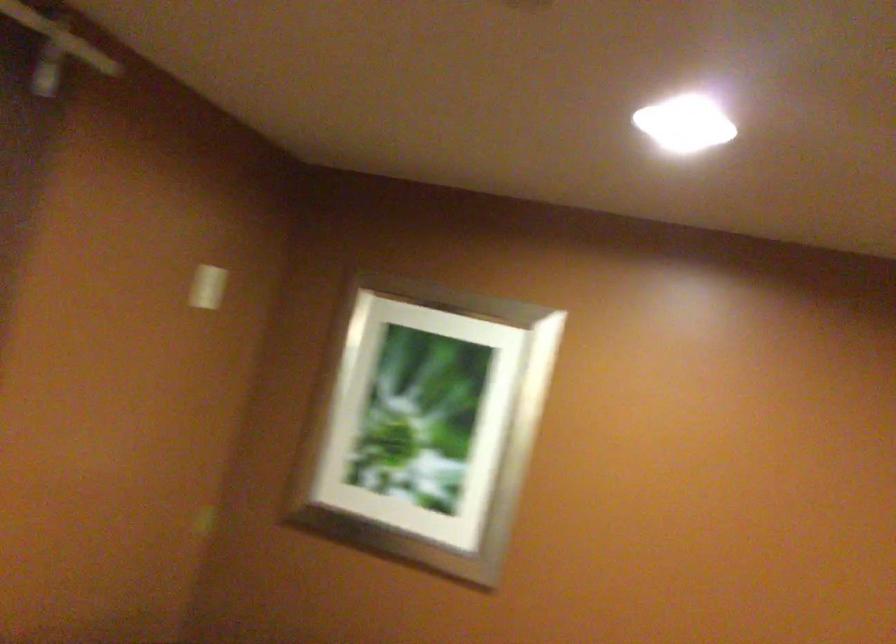
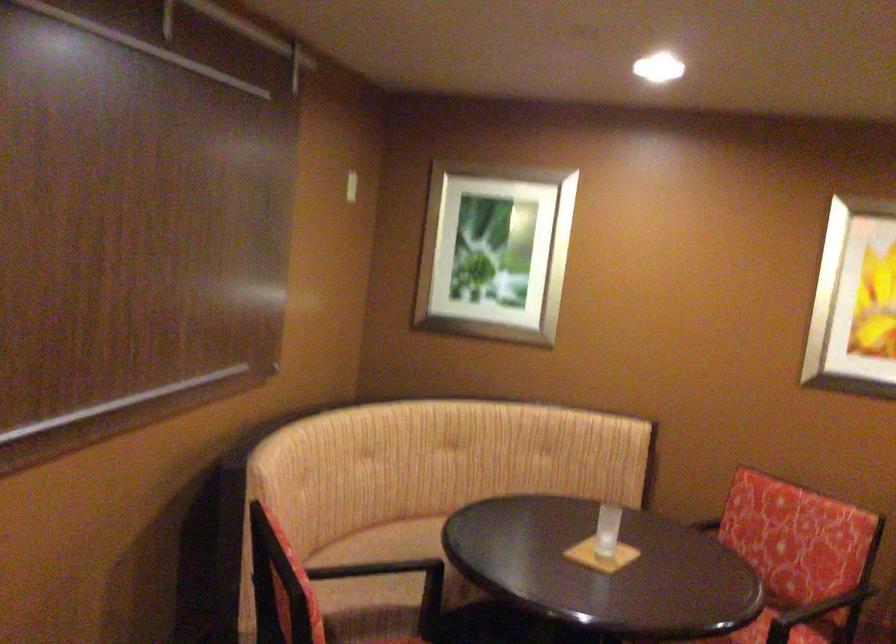
Find the pixel in the second image that matches pixel 216 290 in the first image.

(350, 185)